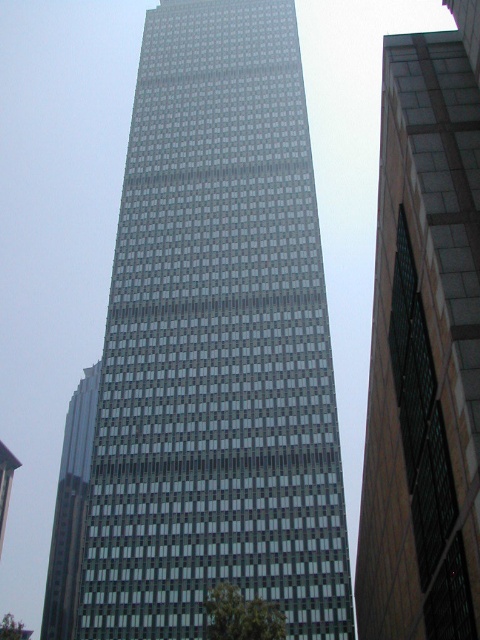
You are a drone operator tasked with flying a drone between the glassy steel tower at center and the glassy reflective skyscraper at left. The drone has a wingspan of 1.5 meters. Based on the scene, can the drone safely navigate the space between them?

The distance between the glassy steel tower at center and the glassy reflective skyscraper at left is 64.21 meters, which is more than enough for the drone with a 1.5 meter wingspan to safely navigate between them.

You are a photographer trying to capture the entire glassy steel tower at center and glassy reflective skyscraper at left in a single shot. Based on their widths, which one should you frame first to ensure both are fully visible in the photo?

The glassy steel tower at center has a lesser width compared to the glassy reflective skyscraper at left. To ensure both are fully visible in the photo, you should frame the glassy reflective skyscraper at left first since it is wider and requires more space in the composition.

You are standing in front of the glassy reflective skyscraper at center and want to take a photo of it. To avoid reflections from the glass, where should you position yourself relative to the building?

The glassy reflective skyscraper at center is located at point (x=424, y=346), so positioning yourself directly in front of it, aligned with the center coordinates, would minimize reflections by avoiding off angles that cause glare.